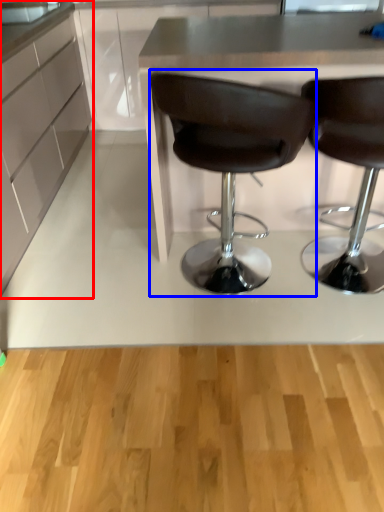
Question: Which object appears farthest to the camera in this image, cabinetry (highlighted by a red box) or chair (highlighted by a blue box)?

Choices:
 (A) cabinetry
 (B) chair

Answer: (A)